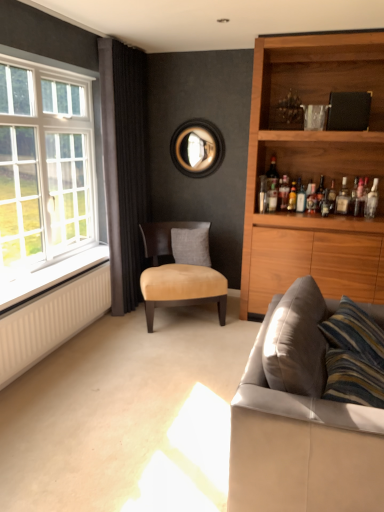
Find the location of `leather couch at lower right`. leather couch at lower right is located at coordinates (300, 420).

What do you see at coordinates (124, 166) in the screenshot? This screenshot has width=384, height=512. I see `dark grey fabric curtain at left` at bounding box center [124, 166].

What do you see at coordinates (342, 198) in the screenshot? I see `translucent glass bottle at upper right, acting as the 2th bottle starting from the right` at bounding box center [342, 198].

Image resolution: width=384 pixels, height=512 pixels. I want to click on leather couch at lower right, so click(300, 420).

From the picture: Is dark grey fabric curtain at left at the right side of white glass window at left?

Correct, you'll find dark grey fabric curtain at left to the right of white glass window at left.

The image size is (384, 512). I want to click on curtain on the right of white glass window at left, so click(124, 166).

How different are the orientations of dark grey fabric curtain at left and white glass window at left in degrees?

The facing directions of dark grey fabric curtain at left and white glass window at left are 0.22 degrees apart.

Which point is more distant from viewer, [142,247] or [9,49]?

The point [142,247] is farther.

The height and width of the screenshot is (512, 384). I want to click on bottle that is the 1st object located above the leather couch at lower right (from the image's perspective), so click(x=371, y=200).

Which of these two, leather couch at lower right or clear glass bottle at upper right, placed as the sixth bottle when sorted from left to right, is bigger?

With larger size is leather couch at lower right.

Relative to clear glass bottle at upper right, placed as the sixth bottle when sorted from left to right, is leather couch at lower right in front or behind?

In the image, leather couch at lower right appears in front of clear glass bottle at upper right, placed as the sixth bottle when sorted from left to right.

Can you confirm if leather couch at lower right is positioned to the left of clear glass bottle at upper right, placed as the sixth bottle when sorted from left to right?

Indeed, leather couch at lower right is positioned on the left side of clear glass bottle at upper right, placed as the sixth bottle when sorted from left to right.

Could you tell me if suede beige chair at center is turned towards white textured radiator at lower left?

No, suede beige chair at center is not aimed at white textured radiator at lower left.

Can you confirm if suede beige chair at center is wider than white textured radiator at lower left?

Correct, the width of suede beige chair at center exceeds that of white textured radiator at lower left.

Is suede beige chair at center smaller than white textured radiator at lower left?

Actually, suede beige chair at center might be larger than white textured radiator at lower left.

Are white glass window at left and matte glass bottle at upper right, the fourth bottle from the right, making contact?

No, white glass window at left is not next to matte glass bottle at upper right, the fourth bottle from the right.

Based on their positions, is white glass window at left located to the left or right of matte glass bottle at upper right, which ranks as the third bottle in left-to-right order?

white glass window at left is to the left of matte glass bottle at upper right, which ranks as the third bottle in left-to-right order.

Which point is more distant from viewer, (x=39, y=173) or (x=304, y=203)?

Positioned behind is point (x=304, y=203).

From the image's perspective, would you say wooden circular frame at center is positioned over white radiator at lower left?

Correct, wooden circular frame at center appears higher than white radiator at lower left in the image.

Considering the sizes of objects wooden circular frame at center and white radiator at lower left in the image provided, who is thinner, wooden circular frame at center or white radiator at lower left?

wooden circular frame at center.

Considering the relative positions of wooden circular frame at center and white radiator at lower left in the image provided, is wooden circular frame at center to the right of white radiator at lower left from the viewer's perspective?

Yes, wooden circular frame at center is to the right of white radiator at lower left.

Between point (174, 163) and point (41, 286), which one is positioned behind?

The point (174, 163) is behind.

Looking at this image, how many degrees apart are the facing directions of suede beige chair at center and white glass window at left?

The angle between the facing direction of suede beige chair at center and the facing direction of white glass window at left is 59.6 degrees.

Are suede beige chair at center and white glass window at left located far from each other?

No, suede beige chair at center is not far away from white glass window at left.

From the image's perspective, would you say suede beige chair at center is shown under white glass window at left?

Indeed, from the image's perspective, suede beige chair at center is shown beneath white glass window at left.

Can you confirm if suede beige chair at center is positioned to the left of white glass window at left?

Incorrect, suede beige chair at center is not on the left side of white glass window at left.

Can you tell me how much wooden circular frame at center and leather couch at lower right differ in facing direction?

The angle between the facing direction of wooden circular frame at center and the facing direction of leather couch at lower right is 91.1 degrees.

Could you tell me if wooden circular frame at center is turned towards leather couch at lower right?

No, wooden circular frame at center is not facing towards leather couch at lower right.

From a real-world perspective, is wooden circular frame at center under leather couch at lower right?

Incorrect, from a real-world perspective, wooden circular frame at center is higher than leather couch at lower right.

Is wooden circular frame at center touching leather couch at lower right?

There is a gap between wooden circular frame at center and leather couch at lower right.

Identify the location of window that is in front of the dark grey fabric curtain at left. This screenshot has height=512, width=384. (45, 168).

Where is `bottle that is the 1st object located behind the leather couch at lower right`? Image resolution: width=384 pixels, height=512 pixels. bottle that is the 1st object located behind the leather couch at lower right is located at coordinates (371, 200).

Based on their spatial positions, is gray fabric pillow at center or leather couch at lower right further from white textured radiator at lower left?

leather couch at lower right is further to white textured radiator at lower left.

Looking at this image, based on their spatial positions, is gray fabric pillow at center or white textured radiator at lower left further from white glass window at left?

The object further to white glass window at left is gray fabric pillow at center.

When comparing their distances from matte glass bottle at upper right, which ranks as the third bottle in left-to-right order, does leather couch at lower right or white radiator at lower left seem closer?

white radiator at lower left lies closer to matte glass bottle at upper right, which ranks as the third bottle in left-to-right order, than the other object.

When comparing their distances from translucent glass bottle at upper right, the 5th bottle positioned from the right, does wooden circular frame at center or leather couch at lower right seem closer?

The object closer to translucent glass bottle at upper right, the 5th bottle positioned from the right, is wooden circular frame at center.

From the image, which object appears to be farther from translucent glass bottle at upper right, which is the 5th bottle from left to right, leather couch at lower right or wooden circular frame at center?

leather couch at lower right.

Looking at the image, which one is located further to wooden circular frame at center, clear glass bottle at upper right, which is counted as the first bottle, starting from the left, or gray fabric pillow at center?

clear glass bottle at upper right, which is counted as the first bottle, starting from the left, is further to wooden circular frame at center.

Looking at the image, which one is located further to white textured radiator at lower left, wooden circular frame at center or translucent glass bottle at upper right, acting as the 2th bottle starting from the right?

translucent glass bottle at upper right, acting as the 2th bottle starting from the right, is positioned further to the anchor white textured radiator at lower left.

From the image, which object appears to be nearer to translucent glass bottle at upper right, marked as the 2th bottle in a left-to-right arrangement, leather couch at lower right or gray fabric pillow at center?

Among the two, gray fabric pillow at center is located nearer to translucent glass bottle at upper right, marked as the 2th bottle in a left-to-right arrangement.

Where is `pillow between white glass window at left and wooden circular frame at center in the front-back direction`? The height and width of the screenshot is (512, 384). pillow between white glass window at left and wooden circular frame at center in the front-back direction is located at coordinates (191, 245).

Locate an element on the screen. The width and height of the screenshot is (384, 512). radiator between white radiator at lower left and translucent glass bottle at upper right, marked as the 2th bottle in a left-to-right arrangement, in the horizontal direction is located at coordinates (51, 320).

Locate an element on the screen. The width and height of the screenshot is (384, 512). curtain between white glass window at left and translucent glass bottle at shelf right, the 4th bottle in the left-to-right sequence is located at coordinates (124, 166).

At what (x,y) coordinates should I click in order to perform the action: click on curtain between leather couch at lower right and translucent glass bottle at shelf right, which ranks as the third bottle in right-to-left order, along the z-axis. Please return your answer as a coordinate pair (x, y). The image size is (384, 512). Looking at the image, I should click on (124, 166).